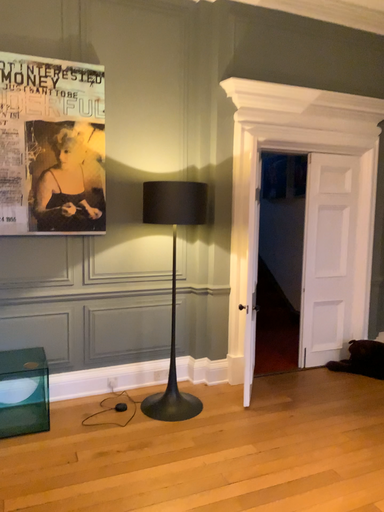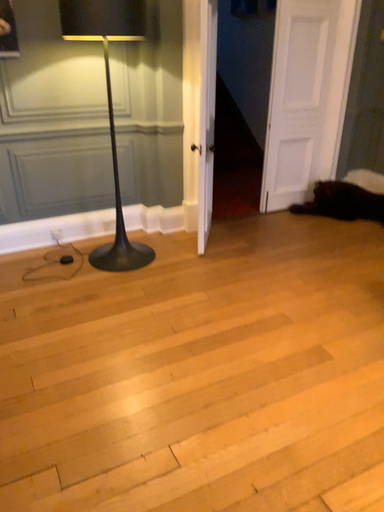
Question: How did the camera likely rotate when shooting the video?

Choices:
 (A) rotated upward
 (B) rotated downward

Answer: (B)